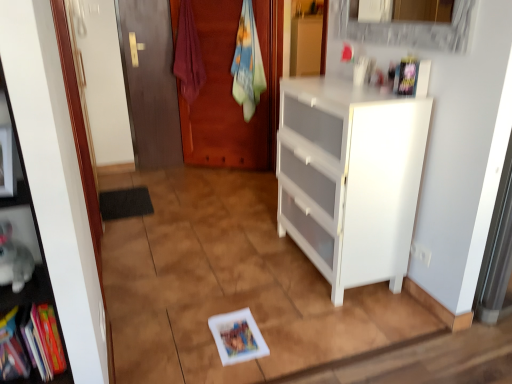
Question: Is multicolored fabric book at lower left, the second book ordered from the bottom, to the left or to the right of white glossy cabinet at right, the 1th cabinetry in the bottom-to-top sequence, in the image?

Choices:
 (A) right
 (B) left

Answer: (B)

Question: From the image's perspective, is multicolored fabric book at lower left, the fourth book in the right-to-left sequence, positioned above or below white glossy cabinet at right, the 1th cabinetry in the bottom-to-top sequence?

Choices:
 (A) above
 (B) below

Answer: (B)

Question: Based on their relative distances, which object is farther from the matte wood door at left?

Choices:
 (A) white glossy cabinet at right, which is counted as the 2th cabinetry, starting from the top
 (B) white matte book at center, which is the first book from bottom to top
 (C) matte red towel at center, the 2th laundry viewed from the right
 (D) matte purple book at upper right, the first book viewed from the top
 (E) white glossy cabinet at upper center, positioned as the first cabinetry in top-to-bottom order

Answer: (D)

Question: Estimate the real-world distances between objects in this image. Which object is closer to the white matte book at center, which ranks as the fourth book in top-to-bottom order?

Choices:
 (A) multicolored fabric book at lower left, the fourth book in the right-to-left sequence
 (B) matte wood door at left
 (C) white glossy cabinet at right, the 1th cabinetry in the bottom-to-top sequence
 (D) matte red towel at center, which is counted as the first laundry, starting from the left
 (E) hardcover book at left, marked as the third book in a bottom-to-top arrangement

Answer: (E)